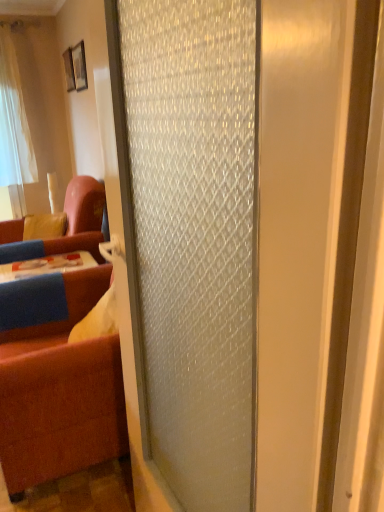
The height and width of the screenshot is (512, 384). Describe the element at coordinates (248, 238) in the screenshot. I see `frosted glass door at center` at that location.

This screenshot has height=512, width=384. Describe the element at coordinates (45, 226) in the screenshot. I see `yellow fabric pillow at left` at that location.

How much space does brown fabric studio couch at left, the second studio couch in the back-to-front sequence, occupy vertically?

The height of brown fabric studio couch at left, the second studio couch in the back-to-front sequence, is 1.06 meters.

Locate an element on the screen. Image resolution: width=384 pixels, height=512 pixels. wooden picture frame at upper left, the second picture frame when ordered from right to left is located at coordinates (69, 69).

Considering the points (309, 370) and (18, 230), which point is behind, point (309, 370) or point (18, 230)?

Point (18, 230)

Is frosted glass door at center turned away from velvet blue couch at left, acting as the first studio couch starting from the back?

No, velvet blue couch at left, acting as the first studio couch starting from the back, is not at the back of frosted glass door at center.

From a real-world perspective, which is physically below, frosted glass door at center or velvet blue couch at left, which is counted as the 2th studio couch, starting from the front?

velvet blue couch at left, which is counted as the 2th studio couch, starting from the front, is physically lower.

Considering the positions of objects brown fabric studio couch at left, the second studio couch in the back-to-front sequence, and velvet blue couch at left, which is counted as the 2th studio couch, starting from the front, in the image provided, who is in front, brown fabric studio couch at left, the second studio couch in the back-to-front sequence, or velvet blue couch at left, which is counted as the 2th studio couch, starting from the front,?

brown fabric studio couch at left, the second studio couch in the back-to-front sequence, is in front.

Does point (56, 402) come behind point (94, 191)?

No.

In terms of height, does brown fabric studio couch at left, which is counted as the 1th studio couch, starting from the front, look taller or shorter compared to velvet blue couch at left, acting as the first studio couch starting from the back?

Considering their sizes, brown fabric studio couch at left, which is counted as the 1th studio couch, starting from the front, has more height than velvet blue couch at left, acting as the first studio couch starting from the back.

Which object is closer to the camera taking this photo, velvet blue couch at left, acting as the first studio couch starting from the back, or brown fabric studio couch at left, the second studio couch in the back-to-front sequence?

brown fabric studio couch at left, the second studio couch in the back-to-front sequence, is closer to the camera.

Considering the relative sizes of velvet blue couch at left, which is counted as the 2th studio couch, starting from the front, and brown fabric studio couch at left, the second studio couch in the back-to-front sequence, in the image provided, is velvet blue couch at left, which is counted as the 2th studio couch, starting from the front, taller than brown fabric studio couch at left, the second studio couch in the back-to-front sequence,?

No, velvet blue couch at left, which is counted as the 2th studio couch, starting from the front, is not taller than brown fabric studio couch at left, the second studio couch in the back-to-front sequence.

Is velvet blue couch at left, which is counted as the 2th studio couch, starting from the front, positioned with its back to brown fabric studio couch at left, the second studio couch in the back-to-front sequence?

No.

Looking at this image, from the image's perspective, between velvet blue couch at left, acting as the first studio couch starting from the back, and brown fabric studio couch at left, which is counted as the 1th studio couch, starting from the front, who is located below?

From the image's view, brown fabric studio couch at left, which is counted as the 1th studio couch, starting from the front, is below.

Is frosted glass door at center far away from wooden picture frame at upper left, the 2th picture frame in the front-to-back sequence?

Absolutely, frosted glass door at center is distant from wooden picture frame at upper left, the 2th picture frame in the front-to-back sequence.

Could you measure the distance between frosted glass door at center and wooden picture frame at upper left, which ranks as the 1th picture frame in left-to-right order?

frosted glass door at center and wooden picture frame at upper left, which ranks as the 1th picture frame in left-to-right order, are 3.81 meters apart from each other.

Between frosted glass door at center and wooden picture frame at upper left, the second picture frame when ordered from right to left, which one has smaller width?

With smaller width is wooden picture frame at upper left, the second picture frame when ordered from right to left.

Is brown fabric studio couch at left, which is counted as the 1th studio couch, starting from the front, oriented towards wooden picture frame at upper left, marked as the 1th picture frame in a front-to-back arrangement?

No, brown fabric studio couch at left, which is counted as the 1th studio couch, starting from the front, is not turned towards wooden picture frame at upper left, marked as the 1th picture frame in a front-to-back arrangement.

From a real-world perspective, is brown fabric studio couch at left, the second studio couch in the back-to-front sequence, on top of wooden picture frame at upper left, marked as the 1th picture frame in a front-to-back arrangement?

Incorrect, from a real-world perspective, brown fabric studio couch at left, the second studio couch in the back-to-front sequence, is lower than wooden picture frame at upper left, marked as the 1th picture frame in a front-to-back arrangement.

Which of these two, brown fabric studio couch at left, which is counted as the 1th studio couch, starting from the front, or wooden picture frame at upper left, marked as the 1th picture frame in a front-to-back arrangement, stands shorter?

wooden picture frame at upper left, marked as the 1th picture frame in a front-to-back arrangement.

Can you confirm if frosted glass door at center is positioned to the right of brown fabric studio couch at left, the second studio couch in the back-to-front sequence?

Yes, frosted glass door at center is to the right of brown fabric studio couch at left, the second studio couch in the back-to-front sequence.

Could you tell me if frosted glass door at center is facing brown fabric studio couch at left, which is counted as the 1th studio couch, starting from the front?

No, frosted glass door at center is not aimed at brown fabric studio couch at left, which is counted as the 1th studio couch, starting from the front.

From a real-world perspective, is frosted glass door at center on brown fabric studio couch at left, the second studio couch in the back-to-front sequence?

Indeed, from a real-world perspective, frosted glass door at center stands above brown fabric studio couch at left, the second studio couch in the back-to-front sequence.

What's the angular difference between brown fabric studio couch at left, the second studio couch in the back-to-front sequence, and frosted glass door at center's facing directions?

The angle between the facing direction of brown fabric studio couch at left, the second studio couch in the back-to-front sequence, and the facing direction of frosted glass door at center is 4.28 degrees.

Is frosted glass door at center at the back of brown fabric studio couch at left, the second studio couch in the back-to-front sequence?

No.

From the image's perspective, is brown fabric studio couch at left, which is counted as the 1th studio couch, starting from the front, positioned above or below frosted glass door at center?

Based on their image positions, brown fabric studio couch at left, which is counted as the 1th studio couch, starting from the front, is located beneath frosted glass door at center.

Considering the sizes of brown fabric studio couch at left, which is counted as the 1th studio couch, starting from the front, and frosted glass door at center in the image, is brown fabric studio couch at left, which is counted as the 1th studio couch, starting from the front, wider or thinner than frosted glass door at center?

brown fabric studio couch at left, which is counted as the 1th studio couch, starting from the front, is wider than frosted glass door at center.

Where is `door on the right of velvet blue couch at left, acting as the first studio couch starting from the back`? This screenshot has width=384, height=512. door on the right of velvet blue couch at left, acting as the first studio couch starting from the back is located at coordinates (248, 238).

The image size is (384, 512). Identify the location of studio couch lying on the left of brown fabric studio couch at left, which is counted as the 1th studio couch, starting from the front. (67, 226).

When comparing their distances from yellow fabric pillow at left, does velvet blue couch at left, acting as the first studio couch starting from the back, or wooden picture frame at upper left, arranged as the first picture frame when viewed from the back, seem further?

Based on the image, wooden picture frame at upper left, arranged as the first picture frame when viewed from the back, appears to be further to yellow fabric pillow at left.

Based on their spatial positions, is velvet blue couch at left, which is counted as the 2th studio couch, starting from the front, or wooden picture frame at upper left, marked as the 1th picture frame in a front-to-back arrangement, closer to yellow fabric pillow at left?

velvet blue couch at left, which is counted as the 2th studio couch, starting from the front, is positioned closer to the anchor yellow fabric pillow at left.

Based on their spatial positions, is frosted glass door at center or yellow fabric pillow at left further from wooden picture frame at upper left, arranged as the second picture frame when viewed from the left?

frosted glass door at center lies further to wooden picture frame at upper left, arranged as the second picture frame when viewed from the left, than the other object.

When comparing their distances from brown fabric studio couch at left, which is counted as the 1th studio couch, starting from the front, does wooden picture frame at upper left, arranged as the first picture frame when viewed from the back, or velvet blue couch at left, which is counted as the 2th studio couch, starting from the front, seem further?

Among the two, wooden picture frame at upper left, arranged as the first picture frame when viewed from the back, is located further to brown fabric studio couch at left, which is counted as the 1th studio couch, starting from the front.

Estimate the real-world distances between objects in this image. Which object is closer to velvet blue couch at left, acting as the first studio couch starting from the back, wooden picture frame at upper left, arranged as the first picture frame when viewed from the back, or frosted glass door at center?

wooden picture frame at upper left, arranged as the first picture frame when viewed from the back, lies closer to velvet blue couch at left, acting as the first studio couch starting from the back, than the other object.

When comparing their distances from yellow fabric pillow at left, does wooden picture frame at upper left, arranged as the second picture frame when viewed from the left, or frosted glass door at center seem closer?

Among the two, wooden picture frame at upper left, arranged as the second picture frame when viewed from the left, is located nearer to yellow fabric pillow at left.

Which object lies nearer to the anchor point brown fabric studio couch at left, which is counted as the 1th studio couch, starting from the front, frosted glass door at center or yellow fabric pillow at left?

frosted glass door at center is closer to brown fabric studio couch at left, which is counted as the 1th studio couch, starting from the front.

Looking at the image, which one is located further to wooden picture frame at upper left, the 2th picture frame in the front-to-back sequence, brown fabric studio couch at left, the second studio couch in the back-to-front sequence, or velvet blue couch at left, acting as the first studio couch starting from the back?

brown fabric studio couch at left, the second studio couch in the back-to-front sequence, is further to wooden picture frame at upper left, the 2th picture frame in the front-to-back sequence.

Locate an element on the screen. Image resolution: width=384 pixels, height=512 pixels. picture frame between wooden picture frame at upper left, the second picture frame when ordered from right to left, and velvet blue couch at left, which is counted as the 2th studio couch, starting from the front, in the vertical direction is located at coordinates pyautogui.click(x=75, y=67).

Locate an element on the screen. The width and height of the screenshot is (384, 512). pillow between brown fabric studio couch at left, the second studio couch in the back-to-front sequence, and wooden picture frame at upper left, arranged as the first picture frame when viewed from the back, in the front-back direction is located at coordinates (45, 226).

Image resolution: width=384 pixels, height=512 pixels. I want to click on studio couch located between brown fabric studio couch at left, which is counted as the 1th studio couch, starting from the front, and yellow fabric pillow at left in the depth direction, so click(67, 226).

Identify the location of pillow between wooden picture frame at upper left, which is the 2th picture frame in back-to-front order, and velvet blue couch at left, acting as the first studio couch starting from the back, vertically. The width and height of the screenshot is (384, 512). (45, 226).